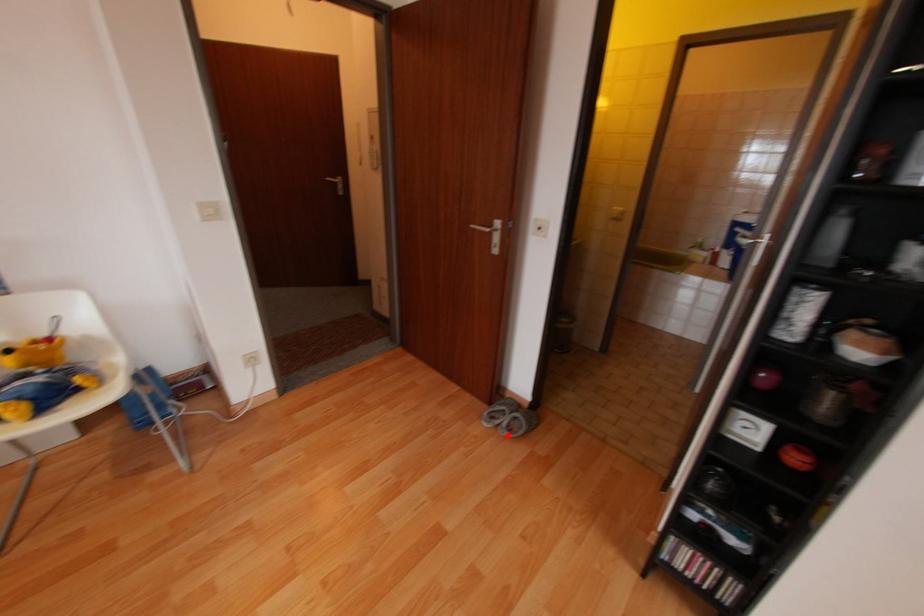
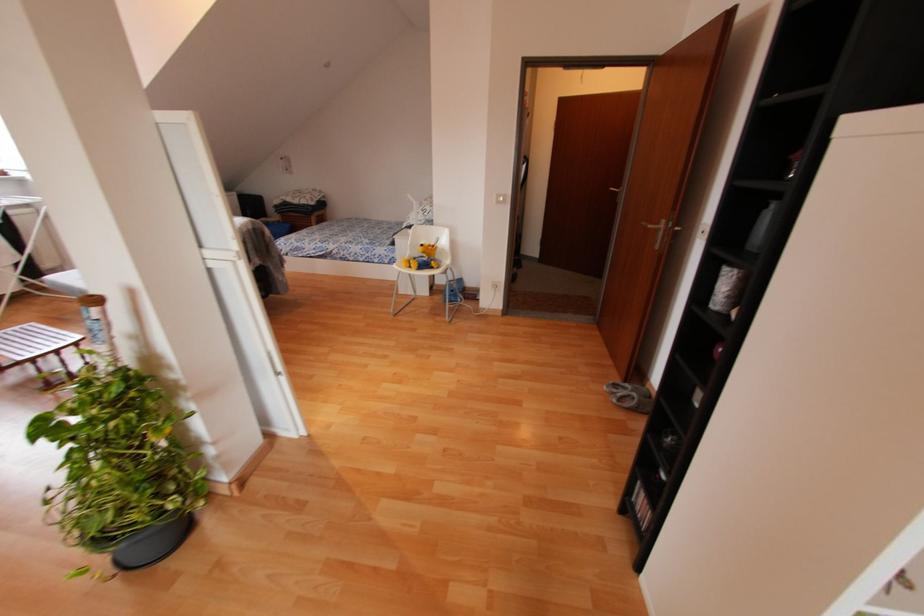
Question: I am providing you with two images of the same scene from different viewpoints. Image1 has a red point marked. In image2, the corresponding 3D location appears at what relative position? Reply with the corresponding letter.

Choices:
 (A) Closer
 (B) Farther

Answer: (A)